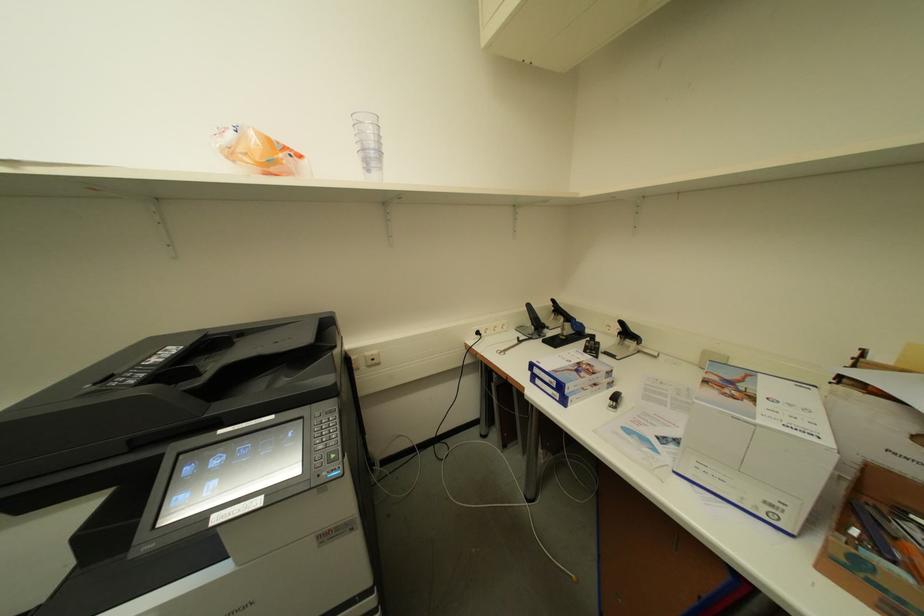
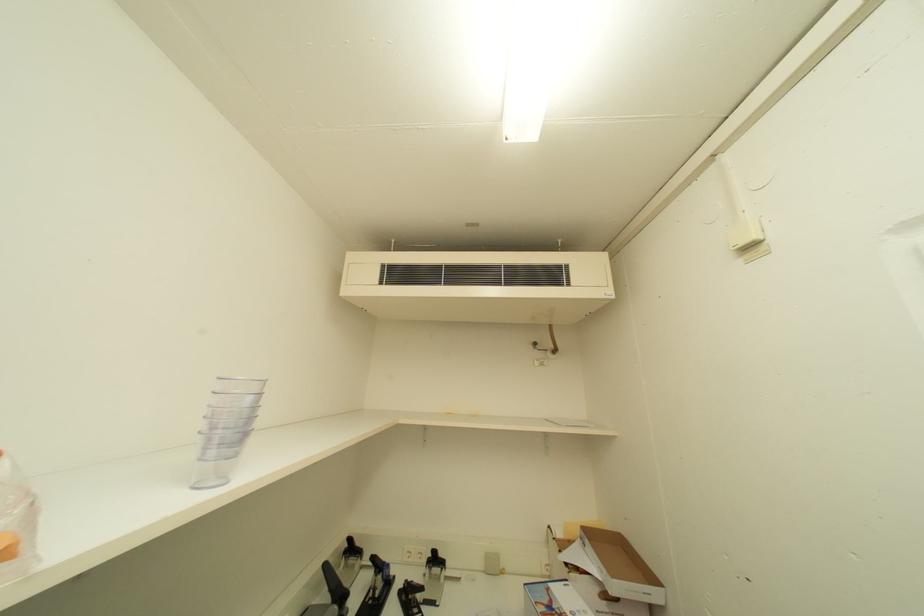
Based on the continuous images, in which direction is the camera rotating?

The camera rotated toward right-up.